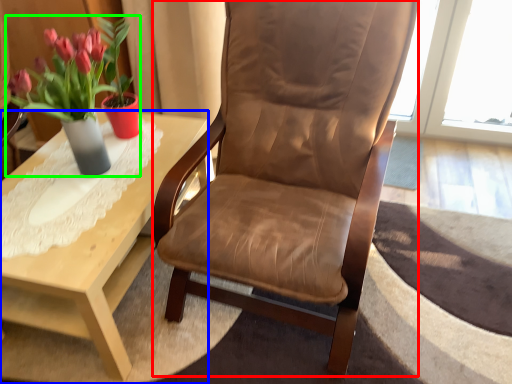
Question: Considering the real-world distances, which object is farthest from chair (highlighted by a red box)? coffee table (highlighted by a blue box) or houseplant (highlighted by a green box)?

Choices:
 (A) coffee table
 (B) houseplant

Answer: (B)